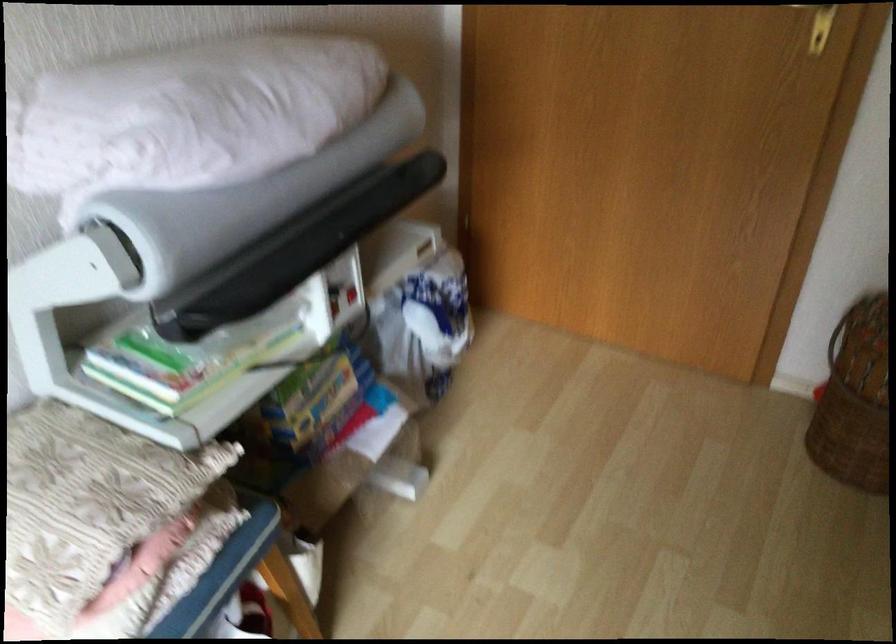
The images are taken continuously from a first-person perspective. In which direction is your viewpoint rotating?

The rotation direction of the camera is left-down.